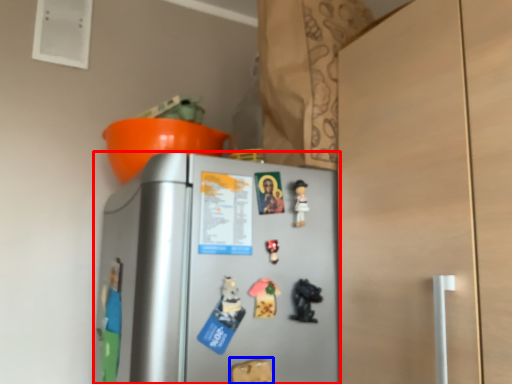
Question: Which of the following is the closest to the observer, refrigerator (highlighted by a red box) or toy (highlighted by a blue box)?

Choices:
 (A) refrigerator
 (B) toy

Answer: (A)